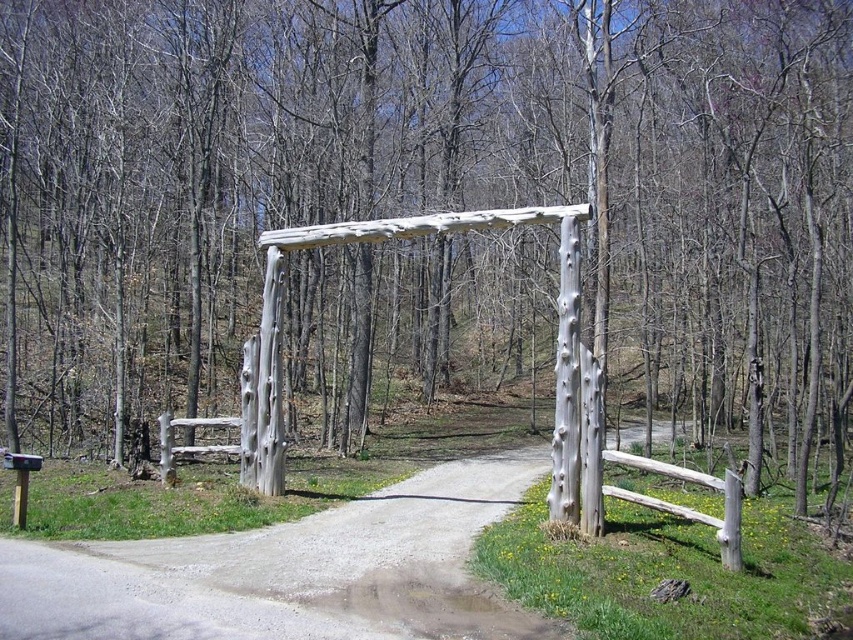
Question: Can you confirm if dirt/gravel path at center is wider than white driftwood gate at center?

Choices:
 (A) no
 (B) yes

Answer: (B)

Question: Which of the following is the closest to the observer?

Choices:
 (A) dirt/gravel path at center
 (B) white driftwood gate at center

Answer: (A)

Question: Among these points, which one is farthest from the camera?

Choices:
 (A) (563, 454)
 (B) (163, 561)

Answer: (A)

Question: Is dirt/gravel path at center wider than white driftwood gate at center?

Choices:
 (A) yes
 (B) no

Answer: (A)

Question: Does dirt/gravel path at center have a larger size compared to white driftwood gate at center?

Choices:
 (A) no
 (B) yes

Answer: (B)